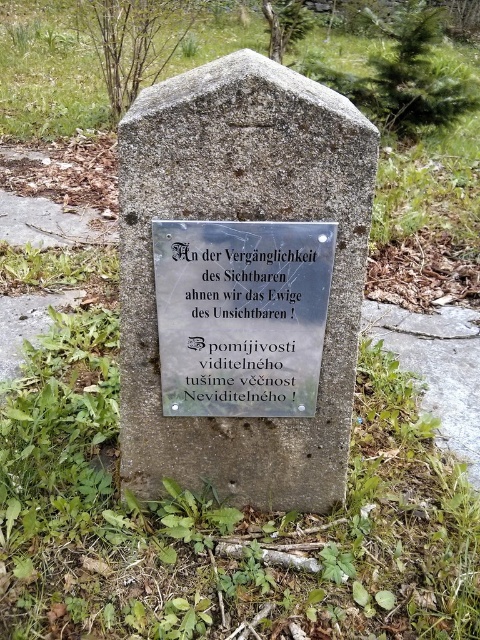
You are standing in a park and see the stone marker with a plaque. The plaque has text in German and Czech. There is a point marked at coordinates (47, 76) on the plaque. What is the color of the area where this point is located?

The point at coordinates (47, 76) on the plaque indicates green grass at center, so the area where this point is located is green.

What is the purpose of the point marked at coordinates (244, 218) on the stone marker?

The point marked at coordinates (244, 218) on the stone marker indicates the location of the smooth stone gravestone at center.

You are a sculptor who wants to create a new plaque for the smooth stone gravestone at center. The current silver metallic plaque at center is already attached. Do you think the new plaque can be wider than the existing one without exceeding the gravestone width?

The smooth stone gravestone at center might be wider than the silver metallic plaque at center, so there is a possibility that a wider plaque could fit, but it depends on the exact dimensions.